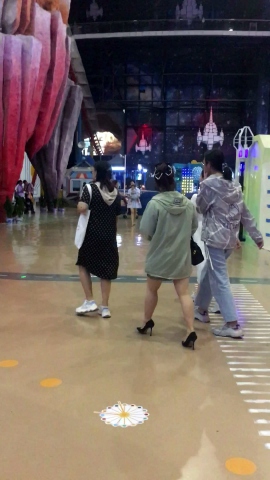
Identify the location of cement flooring. The height and width of the screenshot is (480, 270). (107, 350).